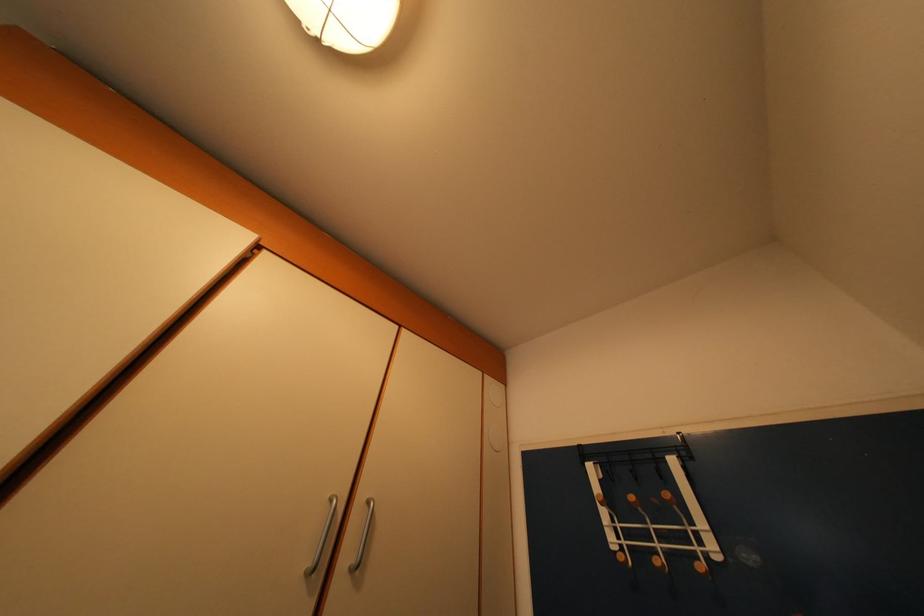
The image size is (924, 616). What are the coordinates of `wooden coat hook` in the screenshot? It's located at (646, 525).